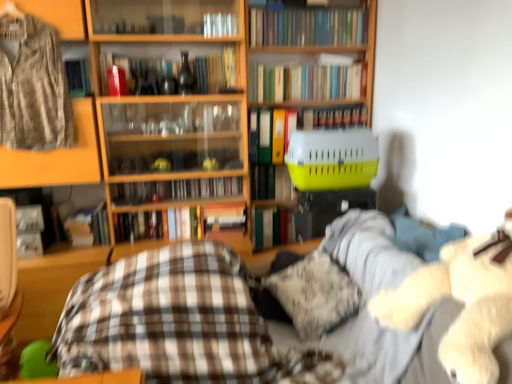
Locate an element on the screen. free space above hardcover books at center, which is the 8th book from top to bottom (from a real-world perspective) is located at coordinates (178, 201).